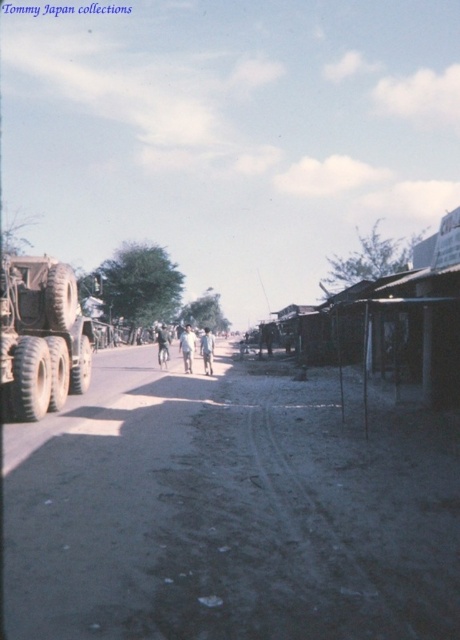
In the scene shown: You are a delivery person who needs to drive a small van along the road. The van has a maximum turning radius of 12 meters. You observe the dusty gravel road at center. Can you safely navigate a turn on this road with your van?

The dusty gravel road at center is located at coordinates point [230,513]. However, without knowing the road width or the curvature of the turn, it is impossible to determine if the van can safely navigate the turn based on the given information.

You are a pedestrian standing on the road and see the matte khaki truck at left and the light brown fabric pants at center. Which object is closer to your left side?

The matte khaki truck at left is positioned on the left side of light brown fabric pants at center, so it is closer to your left side.

You are a pedestrian standing on the side of the road and want to cross to the opposite side. The matte khaki truck at left and the light brown fabric pants at center are in your line of sight. Which object is closer to you as you prepare to cross?

The matte khaki truck at left is closer to the viewer than the light brown fabric pants at center, so the truck is closer to you as you prepare to cross.